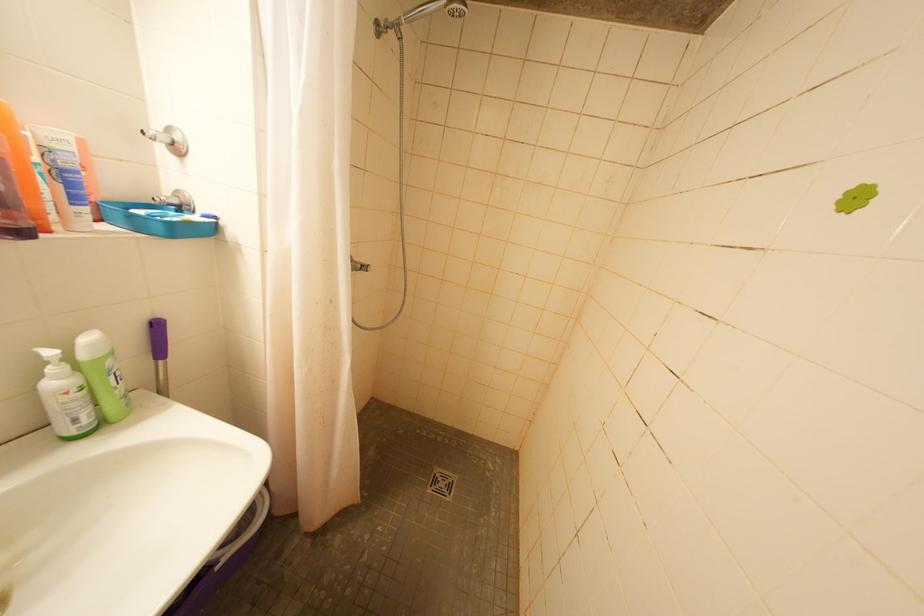
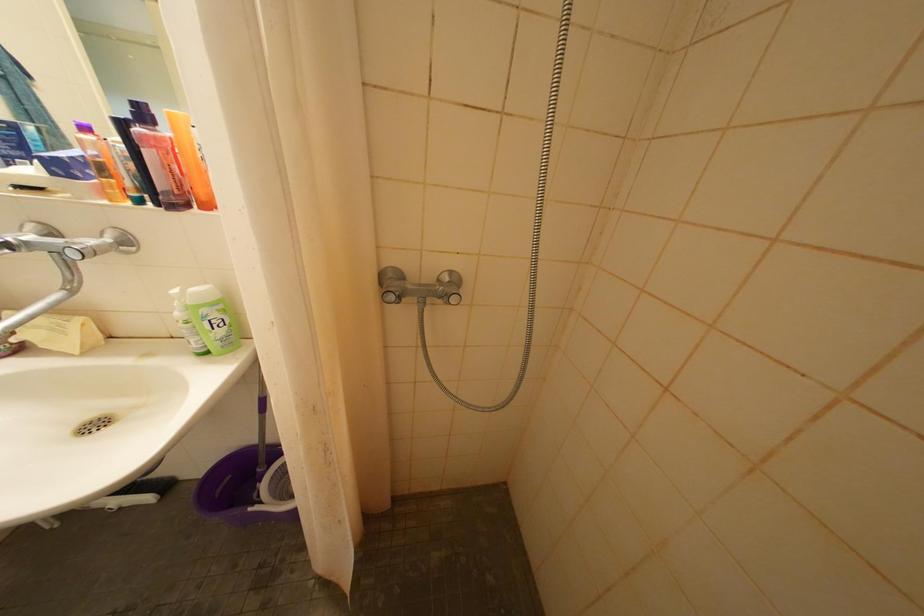
Question: The camera is either moving clockwise (left) or counter-clockwise (right) around the object. The first image is from the beginning of the video and the second image is from the end. Is the camera moving left or right when shooting the video?

Choices:
 (A) Left
 (B) Right

Answer: (B)